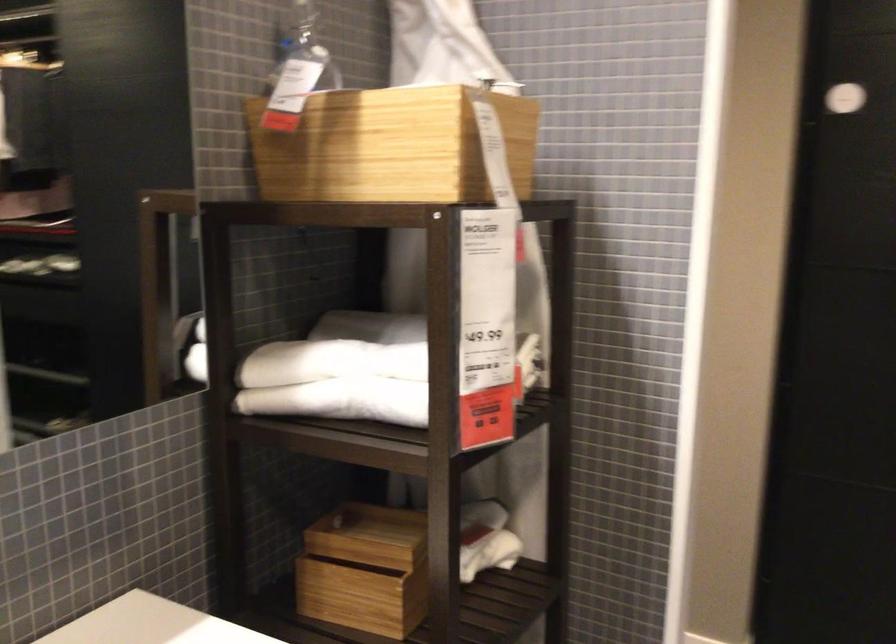
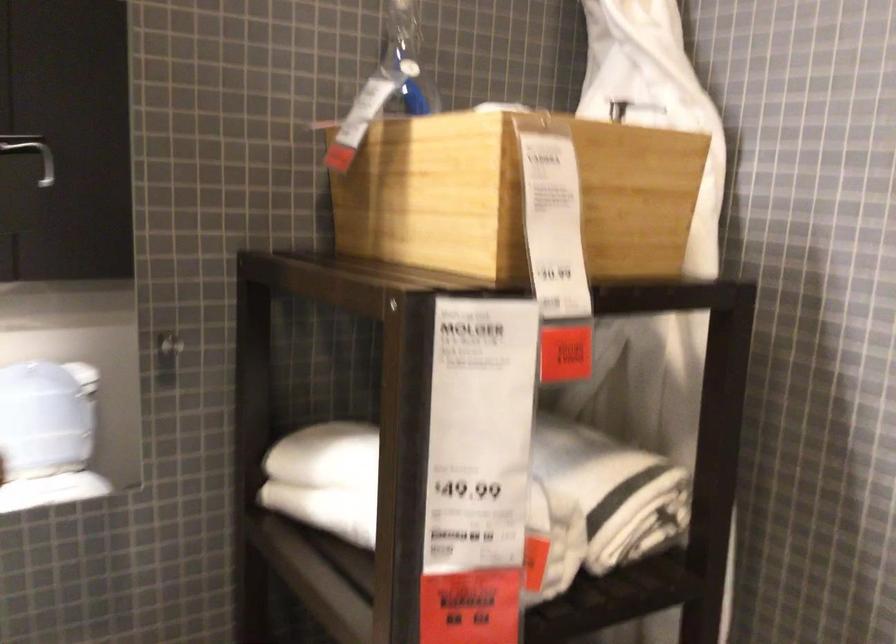
In a continuous first-person perspective shot, in which direction is the camera moving?

The movement direction of the cameraman is right, forward.